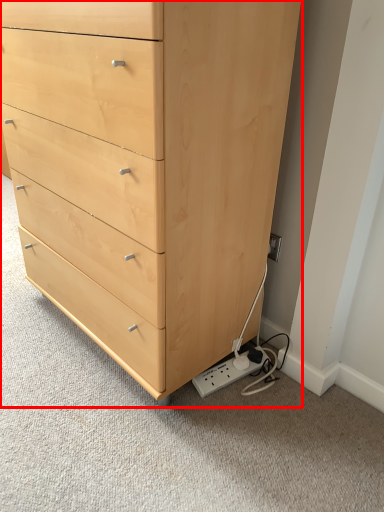
Question: From the image, what is the correct spatial relationship of chest of drawers (annotated by the red box) in relation to plug?

Choices:
 (A) left
 (B) right

Answer: (A)